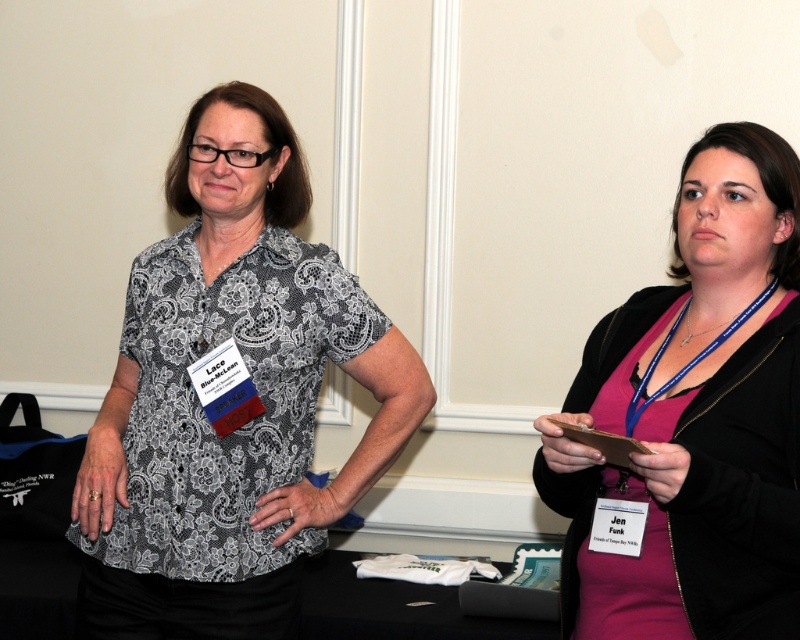
Question: Which of the following is the closest to the observer?

Choices:
 (A) (274, 282)
 (B) (692, 451)

Answer: (B)

Question: Does lace fabric blouse at center have a greater width compared to pink fabric dress at right?

Choices:
 (A) no
 (B) yes

Answer: (B)

Question: Does lace fabric blouse at center appear over pink fabric dress at right?

Choices:
 (A) yes
 (B) no

Answer: (A)

Question: Which of the following is the closest to the observer?

Choices:
 (A) pink fabric dress at right
 (B) lace fabric blouse at center

Answer: (A)

Question: Is lace fabric blouse at center positioned before pink fabric dress at right?

Choices:
 (A) no
 (B) yes

Answer: (A)

Question: Which point is closer to the camera?

Choices:
 (A) pink fabric dress at right
 (B) lace fabric blouse at center

Answer: (A)